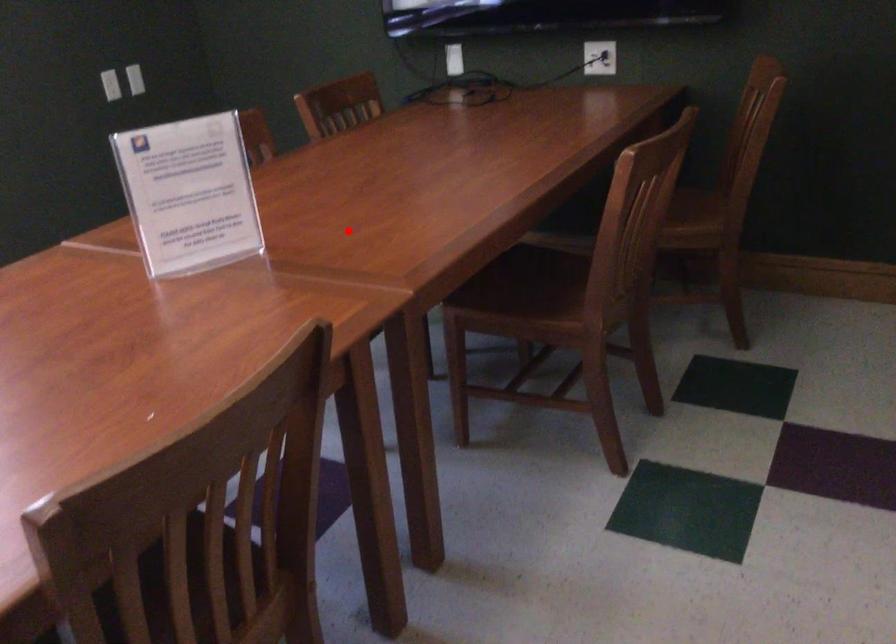
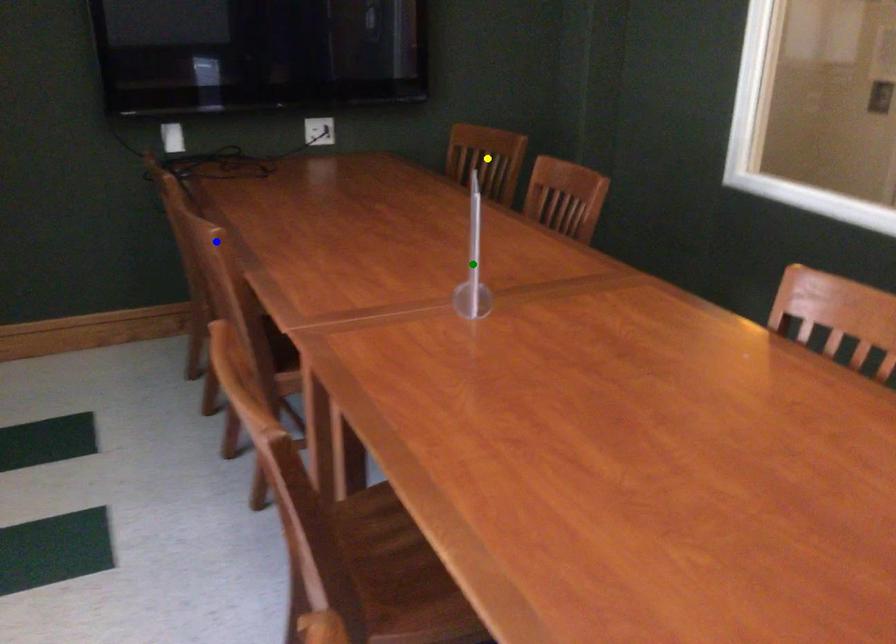
Question: I am providing you with two images of the same scene from different viewpoints. A red point is marked on the first image. You are given multiple points on the second image. Which mark in image 2 goes with the point in image 1?

Choices:
 (A) blue point
 (B) yellow point
 (C) green point

Answer: (C)